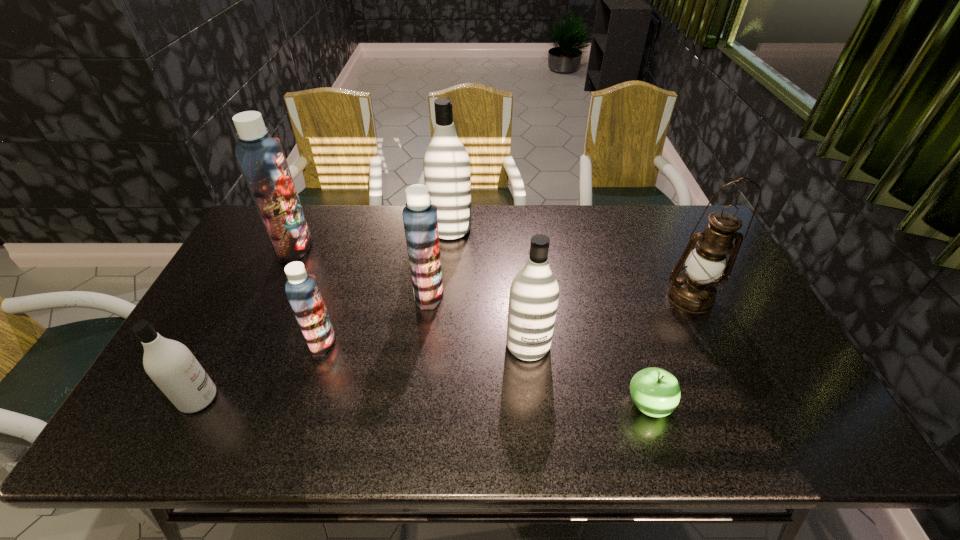
Where is `empty space between the smallest white shampoo and the second farthest white shampoo`? Image resolution: width=960 pixels, height=540 pixels. empty space between the smallest white shampoo and the second farthest white shampoo is located at coordinates (363, 372).

Locate an element on the screen. This screenshot has height=540, width=960. free spot between the second biggest white shampoo and the rightmost object is located at coordinates (610, 321).

You are a GUI agent. You are given a task and a screenshot of the screen. Output one action in this format:
    pyautogui.click(x=<x>, y=<y>)
    Task: Click on the free space between the nearest white shampoo and the brown oil lamp
    
    Given the screenshot: What is the action you would take?
    pyautogui.click(x=444, y=348)

You are a GUI agent. You are given a task and a screenshot of the screen. Output one action in this format:
    pyautogui.click(x=<x>, y=<y>)
    Task: Click on the free space between the farthest white shampoo and the rightmost object
    This screenshot has width=960, height=540.
    Given the screenshot: What is the action you would take?
    pyautogui.click(x=570, y=263)

You are a GUI agent. You are given a task and a screenshot of the screen. Output one action in this format:
    pyautogui.click(x=<x>, y=<y>)
    Task: Click on the object that is the third nearest to the biggest white shampoo
    
    Given the screenshot: What is the action you would take?
    pyautogui.click(x=261, y=158)

Locate which object is the third closest to the second white shampoo from left to right. Please provide its 2D coordinates. Your answer should be formatted as a tuple, i.e. [(x, y)], where the tuple contains the x and y coordinates of a point satisfying the conditions above.

[(261, 158)]

Locate an element on the screen. Image resolution: width=960 pixels, height=540 pixels. shampoo that stands as the fourth closest to the oil lamp is located at coordinates (302, 290).

Locate which shampoo is the fourth closest to the biggest blue shampoo. Please provide its 2D coordinates. Your answer should be formatted as a tuple, i.e. [(x, y)], where the tuple contains the x and y coordinates of a point satisfying the conditions above.

[(170, 364)]

Where is `white shampoo that is the nearest to the farthest white shampoo`? white shampoo that is the nearest to the farthest white shampoo is located at coordinates (534, 292).

In order to click on white shampoo that is the closest to the oil lamp in this screenshot , I will do `click(534, 292)`.